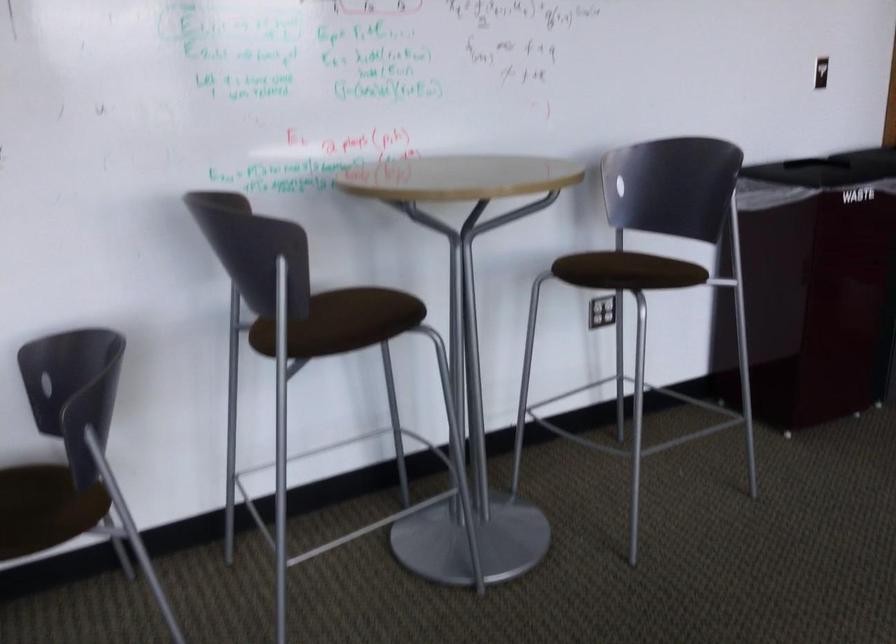
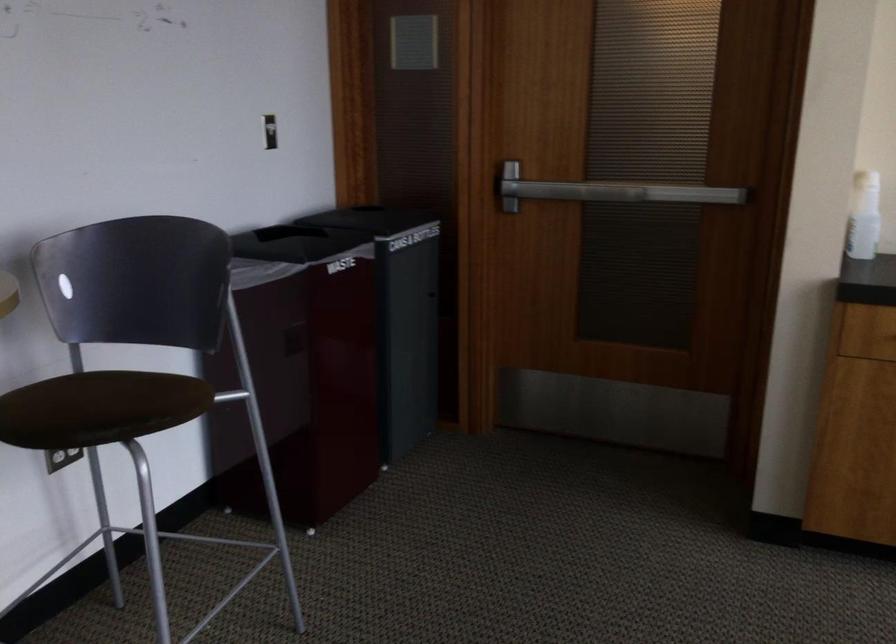
Question: Based on the continuous images, in which direction is the camera rotating? Reply with the corresponding letter.

Choices:
 (A) Left
 (B) Right
 (C) Up
 (D) Down

Answer: (B)